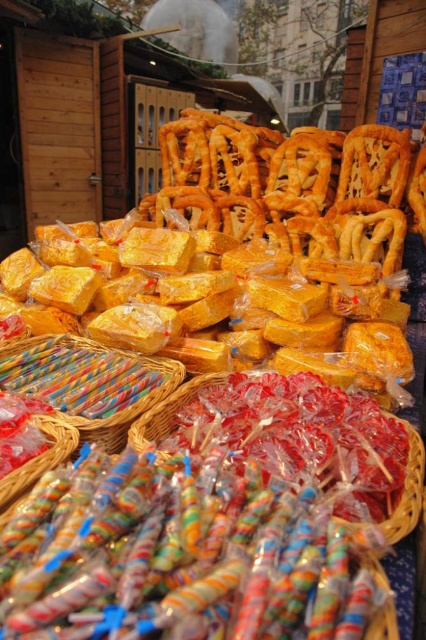
Question: Which of these objects is positioned farthest from the multicolored wrapped lollipops at lower center?

Choices:
 (A) translucent plastic candy at lower center
 (B) multicolored plastic candy at lower center

Answer: (B)

Question: Does multicolored plastic candy sticks at center come in front of translucent plastic candy at lower center?

Choices:
 (A) no
 (B) yes

Answer: (A)

Question: From the image, what is the correct spatial relationship of multicolored plastic candy sticks at center in relation to multicolored plastic candy at lower center?

Choices:
 (A) right
 (B) left

Answer: (B)

Question: Which of these objects is positioned farthest from the translucent plastic candy at lower center?

Choices:
 (A) multicolored wrapped lollipops at lower center
 (B) multicolored plastic candy sticks at center

Answer: (A)

Question: Can you confirm if multicolored plastic candy sticks at center is wider than multicolored plastic candy at lower center?

Choices:
 (A) no
 (B) yes

Answer: (B)

Question: Which of the following is the closest to the observer?

Choices:
 (A) (253, 488)
 (B) (414, 481)

Answer: (A)